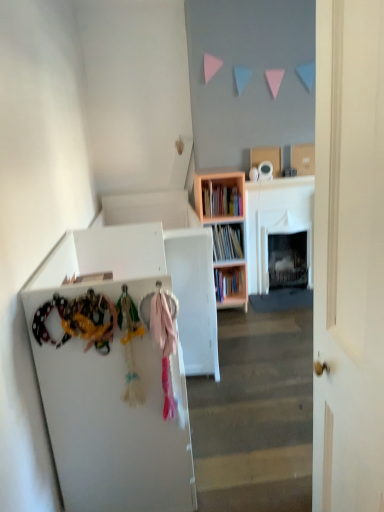
Question: Is white matte door at center completely or partially inside pink wood bookcase at center?

Choices:
 (A) no
 (B) yes

Answer: (A)

Question: Is the surface of pink wood bookcase at center in direct contact with white matte door at center?

Choices:
 (A) yes
 (B) no

Answer: (B)

Question: Is pink wood bookcase at center to the right of white matte door at center from the viewer's perspective?

Choices:
 (A) yes
 (B) no

Answer: (B)

Question: Is there a large distance between pink wood bookcase at center and white matte door at center?

Choices:
 (A) no
 (B) yes

Answer: (B)

Question: Can we say pink wood bookcase at center lies outside white matte door at center?

Choices:
 (A) yes
 (B) no

Answer: (A)

Question: In terms of width, does pink wood bookcase at center look wider or thinner when compared to wooden bookshelf at center?

Choices:
 (A) wide
 (B) thin

Answer: (A)

Question: From the image's perspective, is pink wood bookcase at center positioned above or below wooden bookshelf at center?

Choices:
 (A) below
 (B) above

Answer: (A)

Question: Considering the relative positions of pink wood bookcase at center and wooden bookshelf at center in the image provided, is pink wood bookcase at center to the left or to the right of wooden bookshelf at center?

Choices:
 (A) right
 (B) left

Answer: (A)

Question: Relative to wooden bookshelf at center, is pink wood bookcase at center in front or behind?

Choices:
 (A) behind
 (B) front

Answer: (B)

Question: Is pink wood bookcase at center wider or thinner than pink fabric scarf at center?

Choices:
 (A) thin
 (B) wide

Answer: (B)

Question: From a real-world perspective, is pink wood bookcase at center above or below pink fabric scarf at center?

Choices:
 (A) above
 (B) below

Answer: (B)

Question: Considering the relative positions of pink wood bookcase at center and pink fabric scarf at center in the image provided, is pink wood bookcase at center to the left or to the right of pink fabric scarf at center?

Choices:
 (A) left
 (B) right

Answer: (B)

Question: Would you say pink wood bookcase at center is inside or outside pink fabric scarf at center?

Choices:
 (A) inside
 (B) outside

Answer: (B)

Question: Based on their positions, is pink fabric scarf at center located to the left or right of pink wood bookcase at center?

Choices:
 (A) right
 (B) left

Answer: (B)

Question: Is point (162, 340) closer or farther from the camera than point (203, 180)?

Choices:
 (A) farther
 (B) closer

Answer: (B)